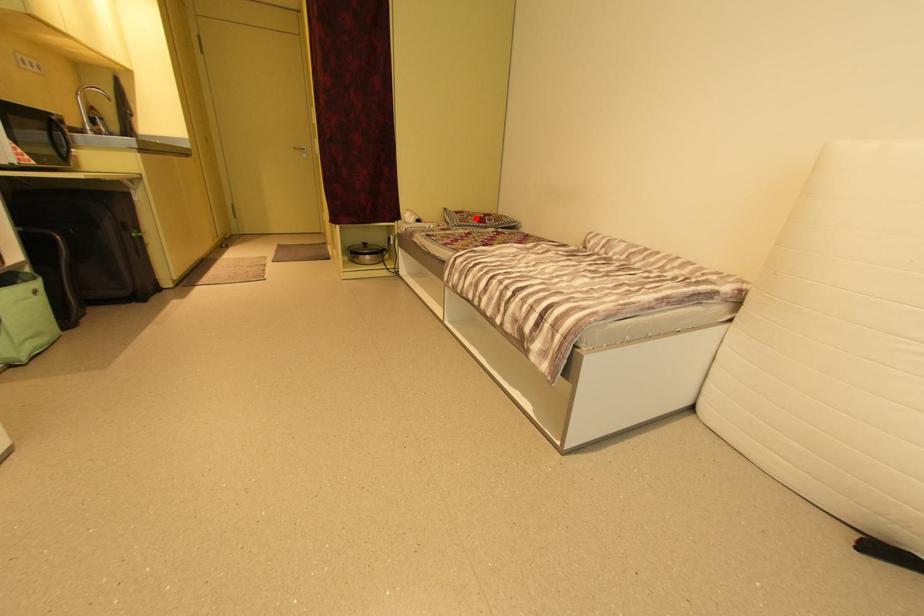
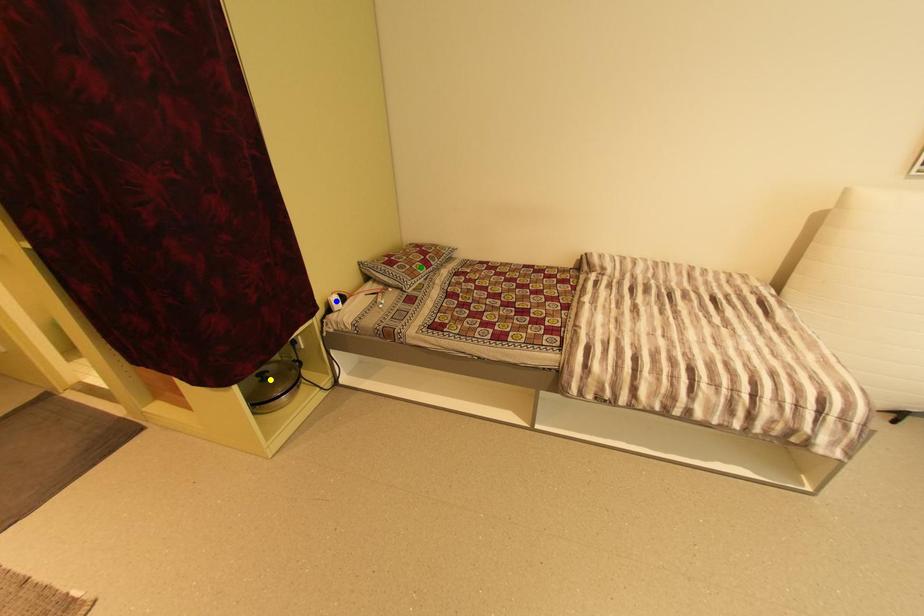
Question: I am providing you with two images of the same scene from different viewpoints. A red point is marked on the first image. You are given multiple points on the second image. Which mark in image 2 goes with the point in image 1?

Choices:
 (A) blue point
 (B) green point
 (C) yellow point

Answer: (B)